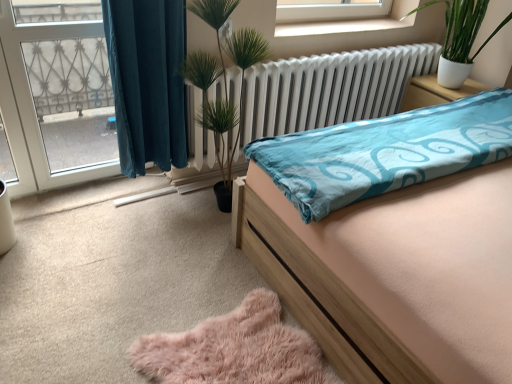
Question: Is the position of transparent glass door at left more distant than that of fluffy pink rug at lower center?

Choices:
 (A) no
 (B) yes

Answer: (B)

Question: Is transparent glass door at left to the left of fluffy pink rug at lower center from the viewer's perspective?

Choices:
 (A) yes
 (B) no

Answer: (A)

Question: Considering the relative sizes of transparent glass door at left and fluffy pink rug at lower center in the image provided, is transparent glass door at left shorter than fluffy pink rug at lower center?

Choices:
 (A) no
 (B) yes

Answer: (A)

Question: Is transparent glass door at left positioned beyond the bounds of fluffy pink rug at lower center?

Choices:
 (A) no
 (B) yes

Answer: (B)

Question: Does transparent glass door at left have a smaller size compared to fluffy pink rug at lower center?

Choices:
 (A) no
 (B) yes

Answer: (A)

Question: Are transparent glass door at left and fluffy pink rug at lower center beside each other?

Choices:
 (A) no
 (B) yes

Answer: (A)

Question: Considering the relative positions of transparent glass door at left and wooden bed at center in the image provided, is transparent glass door at left behind wooden bed at center?

Choices:
 (A) yes
 (B) no

Answer: (A)

Question: Is transparent glass door at left not within wooden bed at center?

Choices:
 (A) yes
 (B) no

Answer: (A)

Question: Considering the relative sizes of transparent glass door at left and wooden bed at center in the image provided, is transparent glass door at left smaller than wooden bed at center?

Choices:
 (A) yes
 (B) no

Answer: (A)

Question: From the image's perspective, would you say transparent glass door at left is shown under wooden bed at center?

Choices:
 (A) yes
 (B) no

Answer: (B)

Question: Would you consider transparent glass door at left to be distant from wooden bed at center?

Choices:
 (A) yes
 (B) no

Answer: (A)

Question: Can you confirm if transparent glass door at left is wider than wooden bed at center?

Choices:
 (A) no
 (B) yes

Answer: (A)

Question: Does white metallic radiator at center come behind white glossy nightstand at upper right?

Choices:
 (A) yes
 (B) no

Answer: (B)